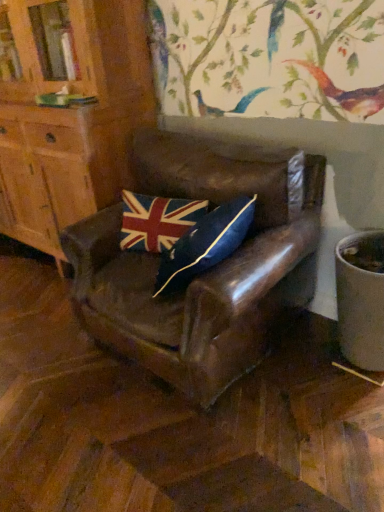
Question: Could you tell me if leather chair at center is facing union jack fabric pillow at center?

Choices:
 (A) no
 (B) yes

Answer: (B)

Question: Does leather chair at center have a greater width compared to union jack fabric pillow at center?

Choices:
 (A) no
 (B) yes

Answer: (B)

Question: From the image's perspective, is leather chair at center above union jack fabric pillow at center?

Choices:
 (A) no
 (B) yes

Answer: (A)

Question: Does leather chair at center have a greater height compared to union jack fabric pillow at center?

Choices:
 (A) yes
 (B) no

Answer: (A)

Question: Is leather chair at center looking in the opposite direction of union jack fabric pillow at center?

Choices:
 (A) yes
 (B) no

Answer: (A)

Question: Is leather chair at center not close to union jack fabric pillow at center?

Choices:
 (A) yes
 (B) no

Answer: (B)

Question: From the image's perspective, is matte wood cabinet at left beneath leather chair at center?

Choices:
 (A) no
 (B) yes

Answer: (A)

Question: Does matte wood cabinet at left have a larger size compared to leather chair at center?

Choices:
 (A) yes
 (B) no

Answer: (A)

Question: Is matte wood cabinet at left directly adjacent to leather chair at center?

Choices:
 (A) no
 (B) yes

Answer: (A)

Question: From a real-world perspective, is matte wood cabinet at left on leather chair at center?

Choices:
 (A) no
 (B) yes

Answer: (B)

Question: Can you confirm if matte wood cabinet at left is wider than leather chair at center?

Choices:
 (A) yes
 (B) no

Answer: (B)

Question: Is matte wood cabinet at left positioned before leather chair at center?

Choices:
 (A) no
 (B) yes

Answer: (A)

Question: Is the depth of matte wood cabinet at left less than that of union jack fabric pillow at center?

Choices:
 (A) no
 (B) yes

Answer: (B)